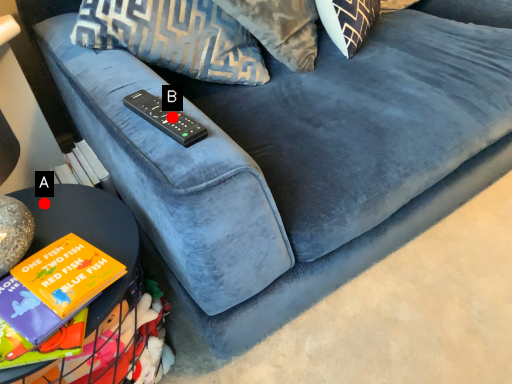
Question: Two points are circled on the image, labeled by A and B beside each circle. Among these points, which one is farthest from the camera?

Choices:
 (A) A is further
 (B) B is further

Answer: (A)